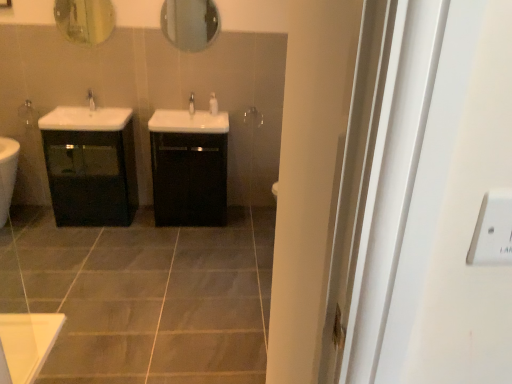
The width and height of the screenshot is (512, 384). I want to click on blank space situated above gray matte tile at center (from a real-world perspective), so click(x=115, y=269).